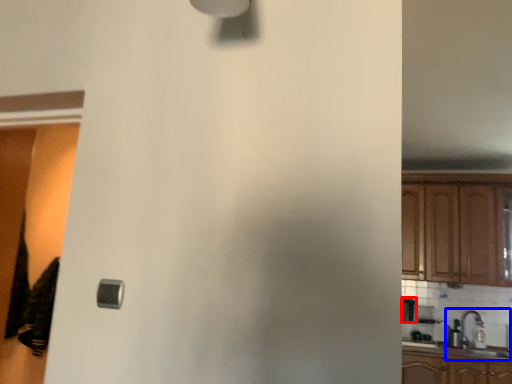
Question: Which point is closer to the camera, appliance (highlighted by a red box) or sink (highlighted by a blue box)?

Choices:
 (A) appliance
 (B) sink

Answer: (B)